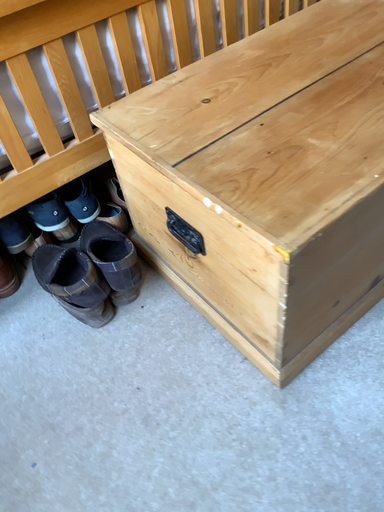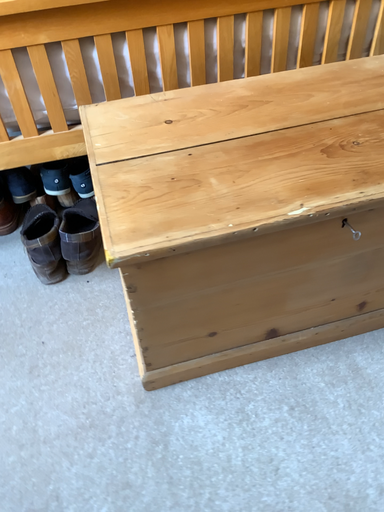
Question: Which way did the camera rotate in the video?

Choices:
 (A) rotated left
 (B) rotated right

Answer: (A)